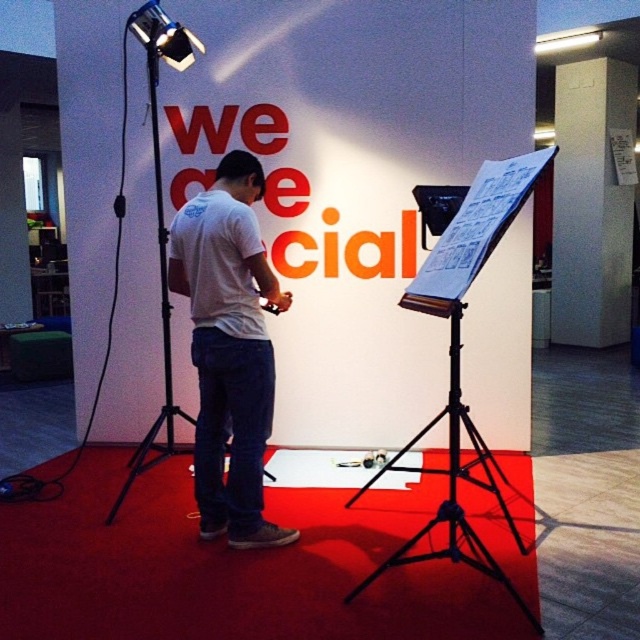
You are setting up a photo shoot and need to place a large equipment box that requires 2 meters of space. You have to choose between placing it near the black metal tripod at left or the metallic projector at upper left. Which object should you place it next to based on size?

The black metal tripod at left is bigger than the metallic projector at upper left, so you should place the equipment box next to the black metal tripod at left because it has more space available.

You are a photographer setting up for a photoshoot. You have a camera that requires a minimum distance of 8 feet from the subject to avoid distortion. The subject is standing on the red carpet. Is the black metal tripod at center positioned far enough away to avoid distortion?

The black metal tripod at center is 7.51 feet away from the camera, which is less than the required 8 feet. Therefore, the tripod is too close and may cause distortion. Move it further back to ensure proper distance.